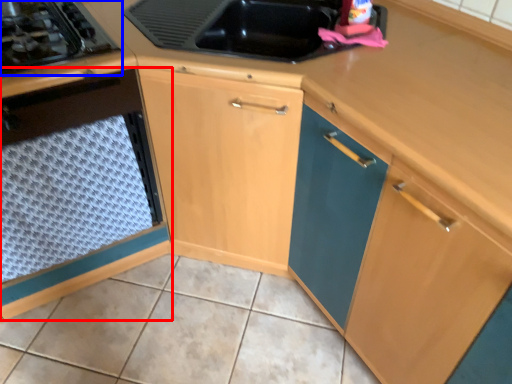
Question: Which of the following is the closest to the observer, cabinetry (highlighted by a red box) or gas stove (highlighted by a blue box)?

Choices:
 (A) cabinetry
 (B) gas stove

Answer: (A)